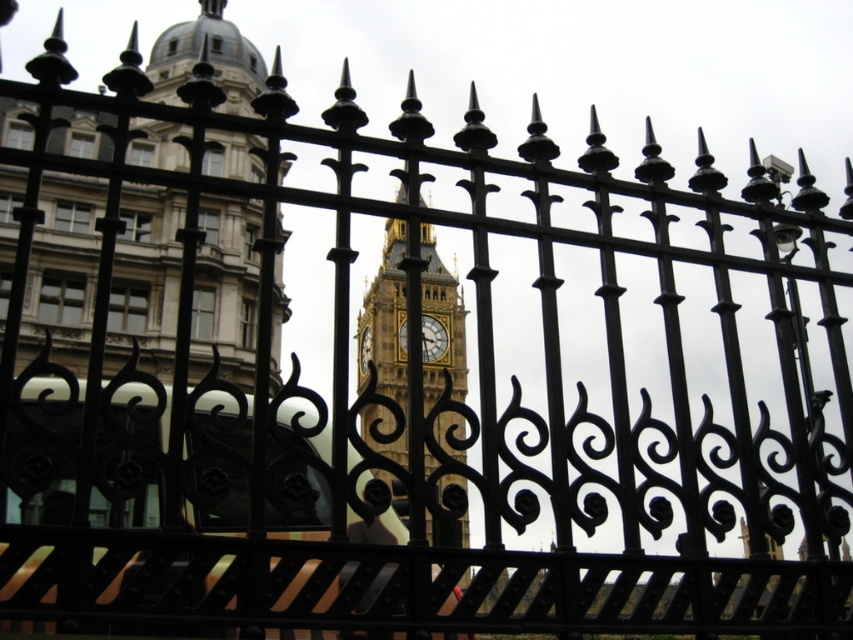
You are a tourist standing in front of the ornate black wrought iron fencing. You see the golden stone clock tower at center and the gold textured clock at center. Which object is taller?

The golden stone clock tower at center is taller than the gold textured clock at center.

You are standing in front of the ornate black wrought iron fencing and want to take a photo of the Big Ben clock tower. There are two points marked on the fence at coordinates point (433, 390) and point (444, 339). Which point is closer to your camera lens so that you can focus better on Big Ben?

Point (433, 390) is closer to the camera than point (444, 339), so focusing on that point would help capture Big Ben more clearly.